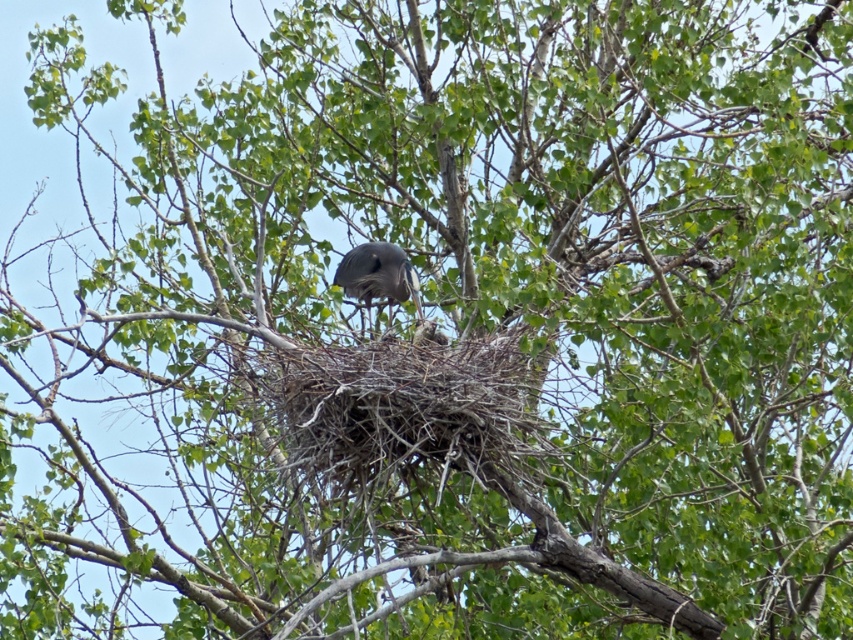
Question: Which of the following is the farthest from the observer?

Choices:
 (A) dark gray nest at center
 (B) gray matte bird at center

Answer: (B)

Question: Can you confirm if dark gray nest at center is bigger than gray matte bird at center?

Choices:
 (A) no
 (B) yes

Answer: (B)

Question: Can you confirm if dark gray nest at center is bigger than gray matte bird at center?

Choices:
 (A) yes
 (B) no

Answer: (A)

Question: Where is dark gray nest at center located in relation to gray matte bird at center in the image?

Choices:
 (A) left
 (B) right

Answer: (B)